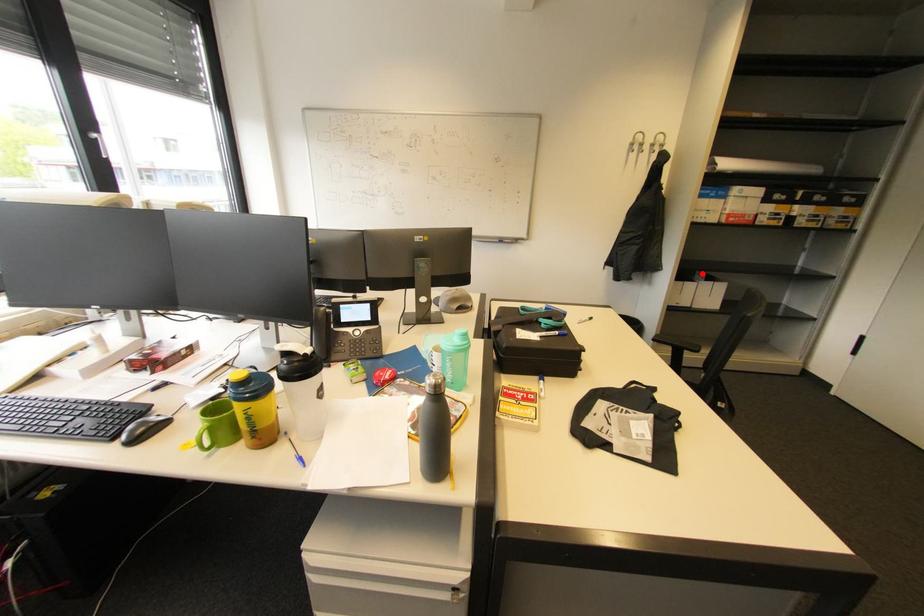
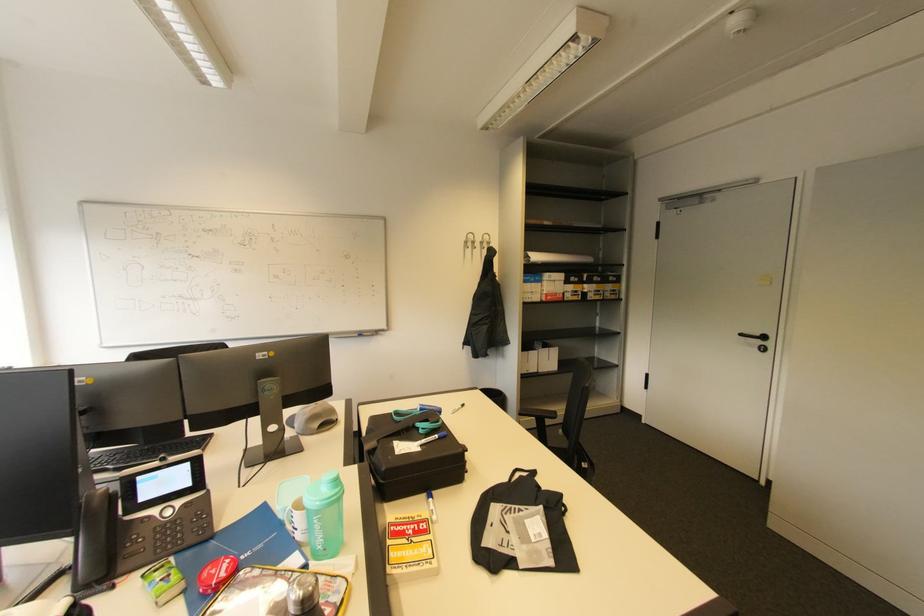
Question: A red point is marked in image1. In image2, is the corresponding 3D point closer to the camera or farther? Reply with the corresponding letter.

Choices:
 (A) The corresponding 3D point is closer.
 (B) The corresponding 3D point is farther.

Answer: (B)